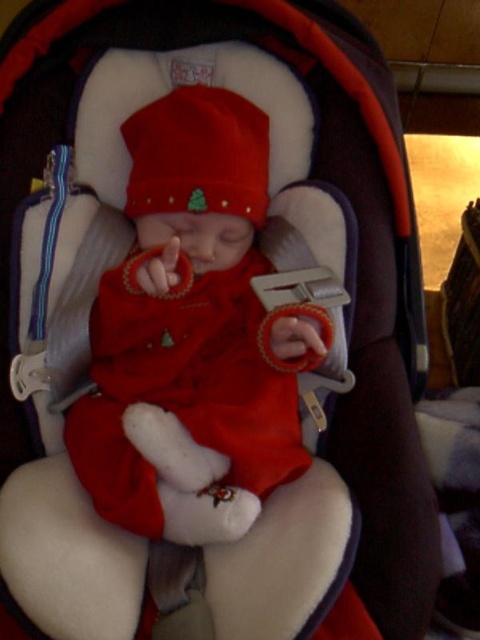
Question: Which point is closer to the camera?

Choices:
 (A) matte red knit hat at center
 (B) matte red fabric baby at center

Answer: (B)

Question: In this image, where is matte red fabric baby at center located relative to matte red knit hat at center?

Choices:
 (A) above
 (B) below

Answer: (B)

Question: Is matte red fabric baby at center to the right of matte red knit hat at center from the viewer's perspective?

Choices:
 (A) no
 (B) yes

Answer: (B)

Question: Is matte red fabric baby at center above matte red knit hat at center?

Choices:
 (A) no
 (B) yes

Answer: (A)